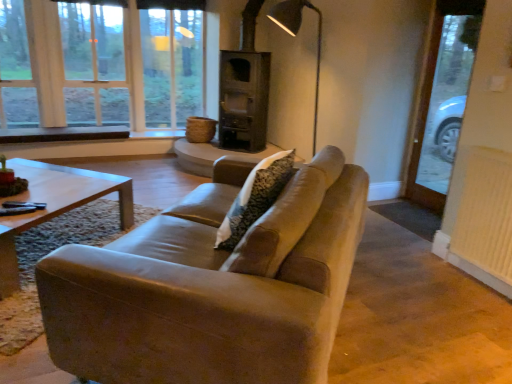
Question: Is clear glass door at right in front of or behind metallic gray floor lamp at upper center in the image?

Choices:
 (A) front
 (B) behind

Answer: (A)

Question: From the image's perspective, is clear glass door at right located above or below metallic gray floor lamp at upper center?

Choices:
 (A) above
 (B) below

Answer: (B)

Question: Estimate the real-world distances between objects in this image. Which object is closer to the clear glass door at right?

Choices:
 (A) metallic gray floor lamp at upper center
 (B) clear glass window at upper left
 (C) leather couch at center
 (D) white textured radiator at right

Answer: (A)

Question: Based on their relative distances, which object is nearer to the metallic gray floor lamp at upper center?

Choices:
 (A) clear glass door at right
 (B) white textured radiator at right
 (C) clear glass window at upper left
 (D) leather couch at center

Answer: (A)